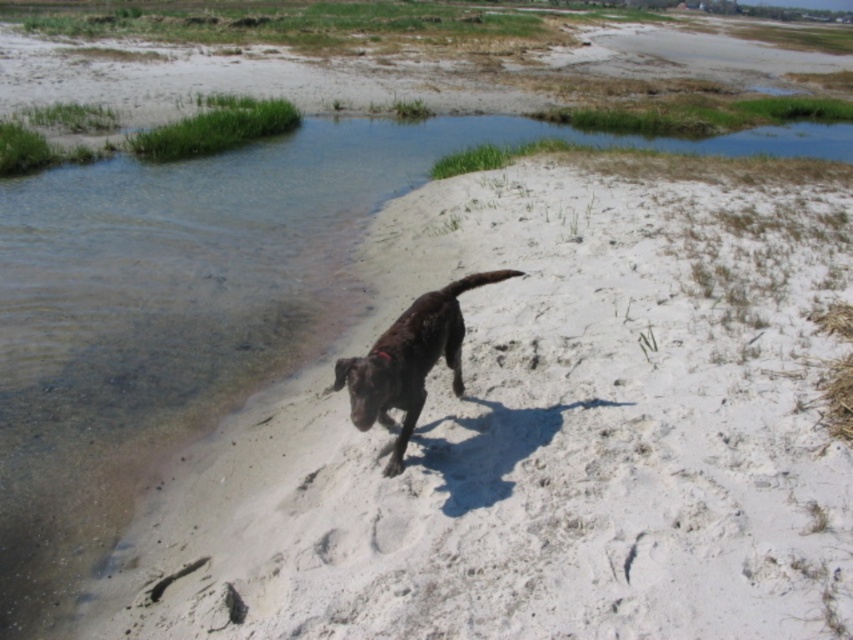
Between white sandy beach at center and brown matte dog at center, which one appears on the right side from the viewer's perspective?

white sandy beach at center

How far apart are white sandy beach at center and brown matte dog at center?

A distance of 6.52 feet exists between white sandy beach at center and brown matte dog at center.

Is point (796, 269) less distant than point (480, 275)?

That is False.

Locate an element on the screen. Image resolution: width=853 pixels, height=640 pixels. white sandy beach at center is located at coordinates (543, 432).